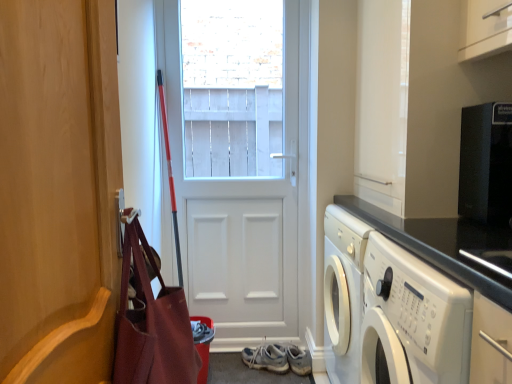
Question: Is white glossy washing machine at lower right inside light blue fabric sneakers at center?

Choices:
 (A) no
 (B) yes

Answer: (A)

Question: Does light blue fabric sneakers at center have a greater height compared to white glossy washing machine at lower right?

Choices:
 (A) yes
 (B) no

Answer: (B)

Question: Is light blue fabric sneakers at center outside of white glossy washing machine at lower right?

Choices:
 (A) no
 (B) yes

Answer: (B)

Question: Is light blue fabric sneakers at center further to the viewer compared to white glossy washing machine at lower right?

Choices:
 (A) no
 (B) yes

Answer: (B)

Question: Considering the relative sizes of light blue fabric sneakers at center and white glossy washing machine at lower right in the image provided, is light blue fabric sneakers at center bigger than white glossy washing machine at lower right?

Choices:
 (A) yes
 (B) no

Answer: (B)

Question: From their relative heights in the image, would you say white glossy washing machine at lower right is taller or shorter than wooden door at left, placed as the 1th door when sorted from front to back?

Choices:
 (A) tall
 (B) short

Answer: (B)

Question: Relative to wooden door at left, placed as the 1th door when sorted from front to back, is white glossy washing machine at lower right in front or behind?

Choices:
 (A) front
 (B) behind

Answer: (B)

Question: Is white glossy washing machine at lower right to the left or to the right of wooden door at left, positioned as the 2th door in back-to-front order, in the image?

Choices:
 (A) right
 (B) left

Answer: (A)

Question: Is white glossy washing machine at lower right situated inside wooden door at left, placed as the 1th door when sorted from front to back, or outside?

Choices:
 (A) inside
 (B) outside

Answer: (B)

Question: From a real-world perspective, is wooden door at left, positioned as the 2th door in back-to-front order, positioned above or below white matte door at center, the 1th door in the back-to-front sequence?

Choices:
 (A) below
 (B) above

Answer: (B)

Question: Does point (100, 342) appear closer or farther from the camera than point (282, 148)?

Choices:
 (A) farther
 (B) closer

Answer: (B)

Question: In the image, is wooden door at left, placed as the 1th door when sorted from front to back, on the left side or the right side of white matte door at center, acting as the 2th door starting from the front?

Choices:
 (A) left
 (B) right

Answer: (A)

Question: Is wooden door at left, positioned as the 2th door in back-to-front order, taller or shorter than white matte door at center, the 1th door in the back-to-front sequence?

Choices:
 (A) short
 (B) tall

Answer: (A)

Question: Is point (273, 370) closer or farther from the camera than point (470, 183)?

Choices:
 (A) closer
 (B) farther

Answer: (B)

Question: Is light blue fabric sneakers at center spatially inside black matte microwave at upper right, or outside of it?

Choices:
 (A) inside
 (B) outside

Answer: (B)